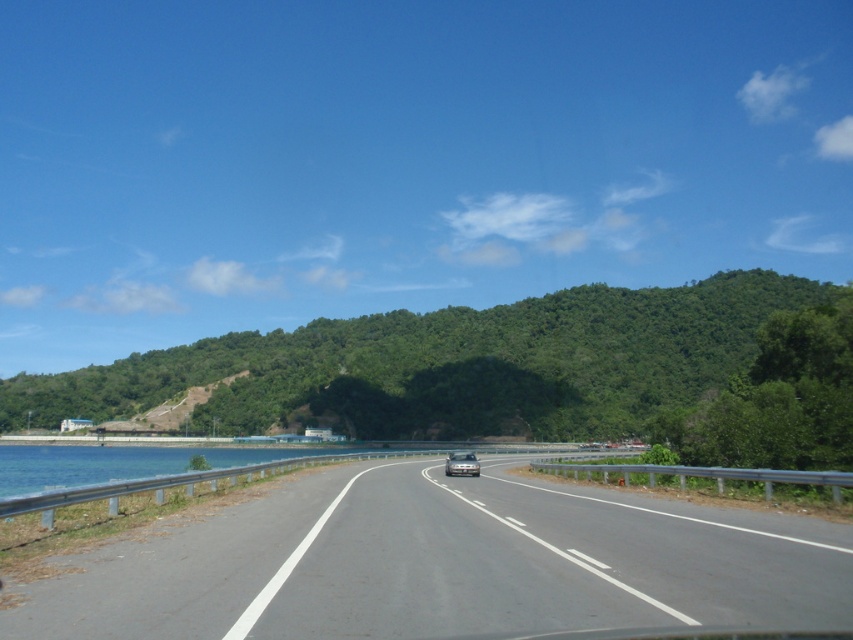
You are a driver approaching the gray asphalt highway at center and see the silver metallic car at center ahead of you. Which object is higher in the image?

The gray asphalt highway at center is taller than the silver metallic car at center according to the description.

You are driving a car and want to know if the gray asphalt highway at center is above or below the silver metallic car at center. Based on the scene, what is the relationship between their positions?

The gray asphalt highway at center is located above the silver metallic car at center, meaning the car is on the highway.